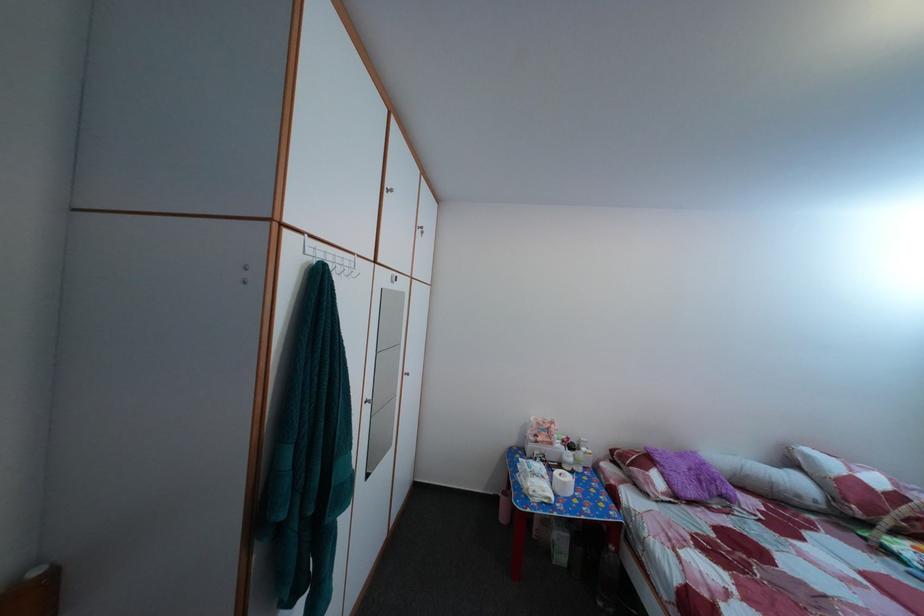
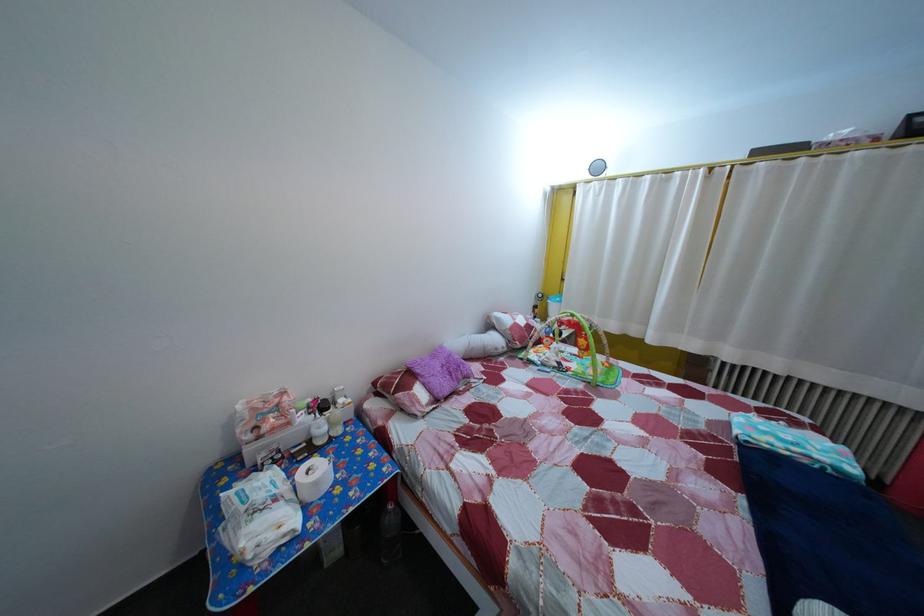
The point at (568, 453) is marked in the first image. Where is the corresponding point in the second image?

(311, 427)